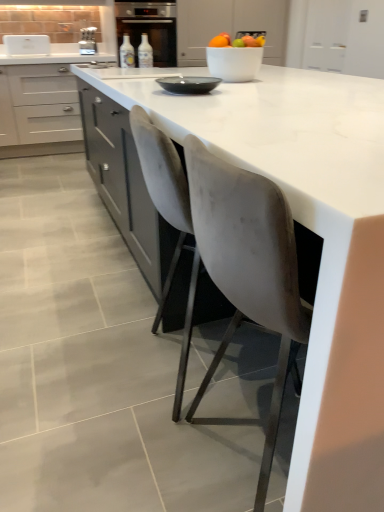
Question: Is translucent glass bottle at center, the first bottle positioned from the left, facing towards translucent glass bottle at center, which ranks as the second bottle in left-to-right order?

Choices:
 (A) no
 (B) yes

Answer: (A)

Question: Does translucent glass bottle at center, the second bottle from the right, have a greater height compared to translucent glass bottle at center, which ranks as the second bottle in left-to-right order?

Choices:
 (A) yes
 (B) no

Answer: (A)

Question: Can you confirm if translucent glass bottle at center, the first bottle positioned from the left, is bigger than translucent glass bottle at center, the first bottle viewed from the right?

Choices:
 (A) yes
 (B) no

Answer: (B)

Question: Is translucent glass bottle at center, the second bottle from the right, smaller than translucent glass bottle at center, the first bottle viewed from the right?

Choices:
 (A) no
 (B) yes

Answer: (B)

Question: Is translucent glass bottle at center, the first bottle positioned from the left, positioned in front of translucent glass bottle at center, the first bottle viewed from the right?

Choices:
 (A) yes
 (B) no

Answer: (B)

Question: Is translucent glass bottle at center, the second bottle from the right, at the right side of translucent glass bottle at center, the first bottle viewed from the right?

Choices:
 (A) no
 (B) yes

Answer: (A)

Question: Is translucent glass bottle at center, the first bottle viewed from the right, at the left side of metallic silver toaster at upper left?

Choices:
 (A) no
 (B) yes

Answer: (A)

Question: Is there a large distance between translucent glass bottle at center, the first bottle viewed from the right, and metallic silver toaster at upper left?

Choices:
 (A) yes
 (B) no

Answer: (A)

Question: Is translucent glass bottle at center, the first bottle viewed from the right, bigger than metallic silver toaster at upper left?

Choices:
 (A) yes
 (B) no

Answer: (B)

Question: Is translucent glass bottle at center, the first bottle viewed from the right, shorter than metallic silver toaster at upper left?

Choices:
 (A) yes
 (B) no

Answer: (A)

Question: Does translucent glass bottle at center, which ranks as the second bottle in left-to-right order, turn towards metallic silver toaster at upper left?

Choices:
 (A) yes
 (B) no

Answer: (B)

Question: Is translucent glass bottle at center, the first bottle viewed from the right, smaller than metallic silver toaster at upper left?

Choices:
 (A) yes
 (B) no

Answer: (A)

Question: Can you confirm if metallic silver toaster at upper left is shorter than matte black bowl at center?

Choices:
 (A) no
 (B) yes

Answer: (A)